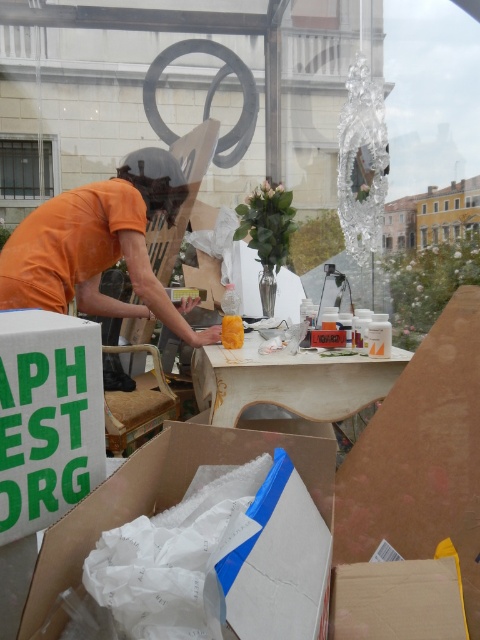
You are standing inside the glass structure and need to locate both the orange cotton shirt at left and the yellow matte sponge at center. Which object is positioned more to the left?

The orange cotton shirt at left is positioned to the left of the yellow matte sponge at center, so the orange cotton shirt at left is more to the left.

You are a delivery person who needs to place a fragile package on the table between the orange cotton shirt at left and the yellow matte sponge at center. The package requires a space of 20 inches. Can you fit it there?

The distance between the orange cotton shirt at left and the yellow matte sponge at center is 23.41 inches, which is more than enough to accommodate the 20 inches required for the fragile package.